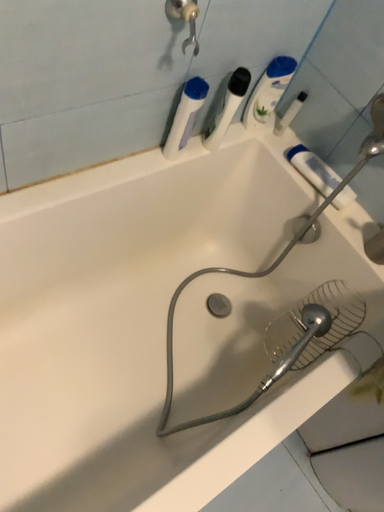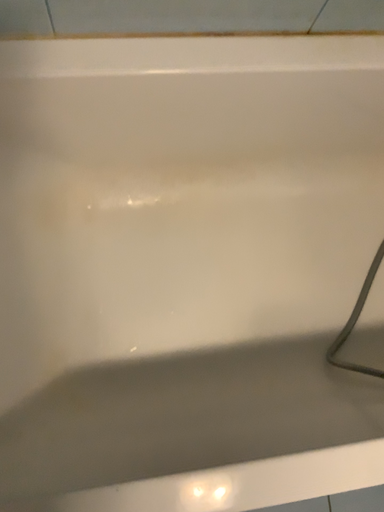
Question: Which way did the camera rotate in the video?

Choices:
 (A) rotated upward
 (B) rotated downward

Answer: (B)